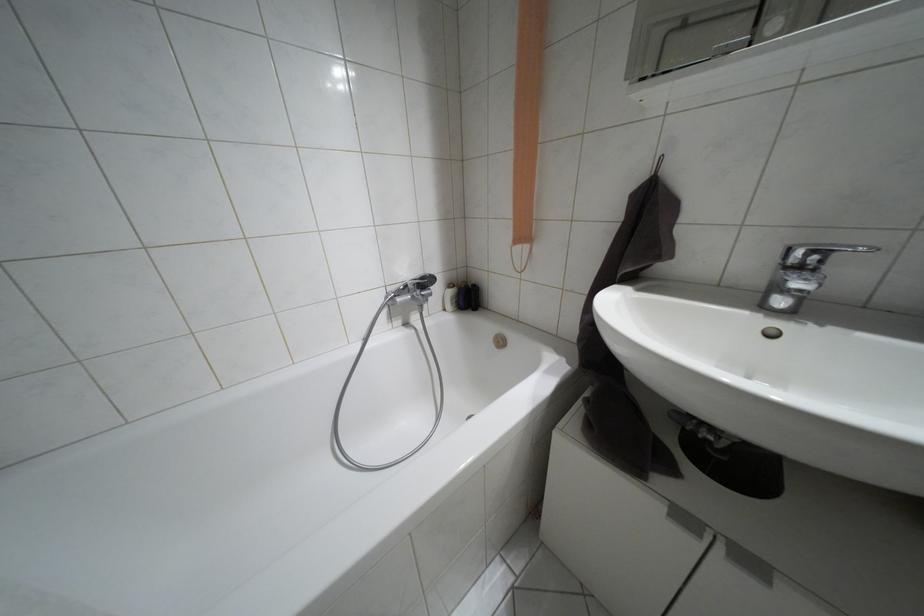
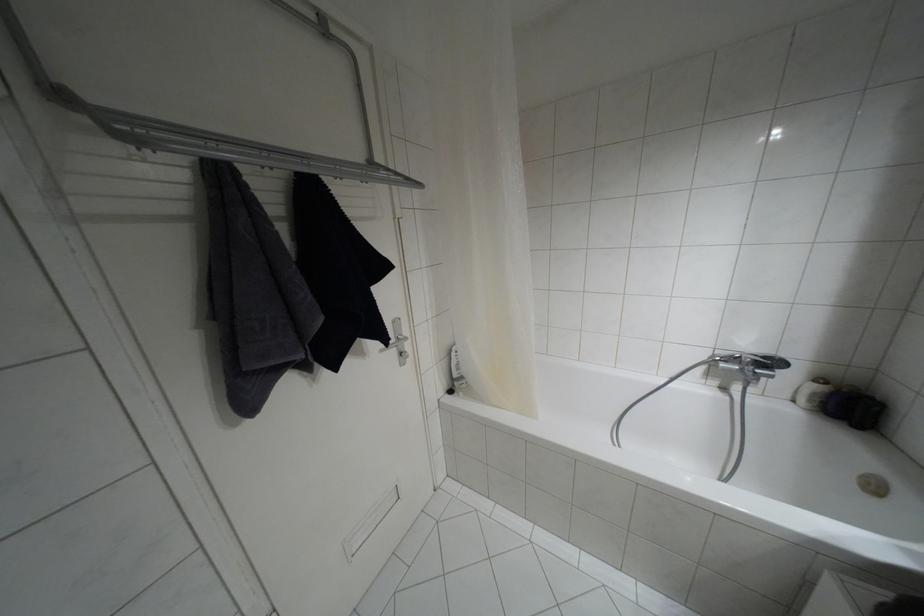
Where in the second image is the point corresponding to the point at 448,285 from the first image?

(820, 379)